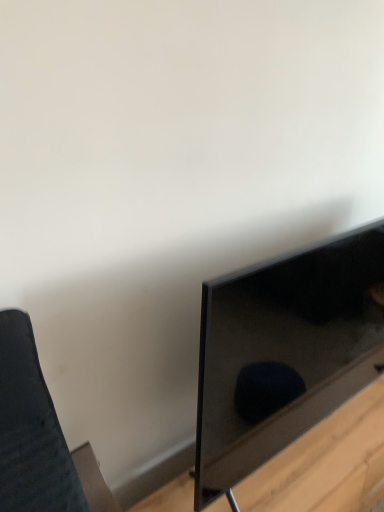
The image size is (384, 512). Describe the element at coordinates (284, 352) in the screenshot. I see `matte black tv at right` at that location.

Find the location of `matte black tv at right`. matte black tv at right is located at coordinates (284, 352).

Identify the location of matte black tv at right. This screenshot has width=384, height=512. (284, 352).